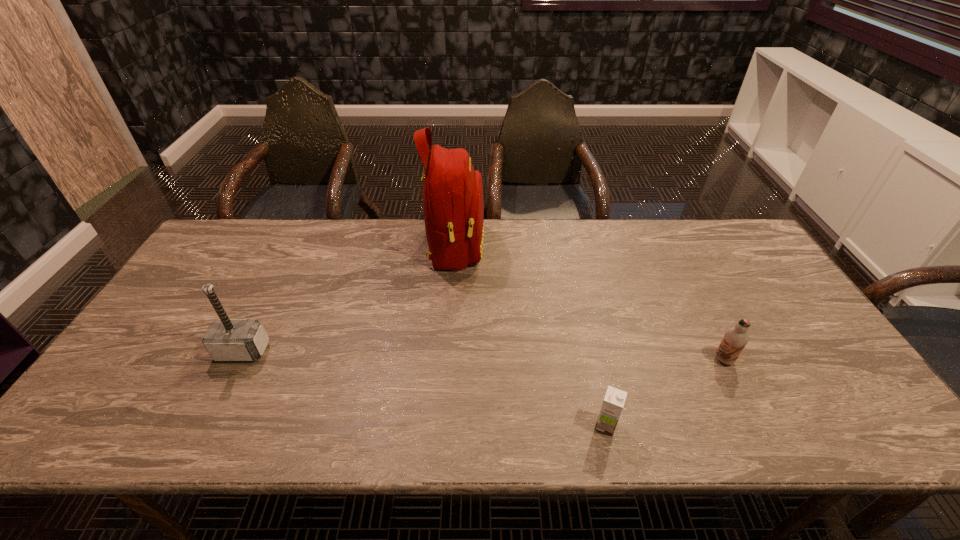
In order to click on free location that satisfies the following two spatial constraints: 1. on the front-facing side of the farthest object; 2. for striking with the head of the leftmost object in this screenshot , I will do `click(447, 351)`.

You are a GUI agent. You are given a task and a screenshot of the screen. Output one action in this format:
    pyautogui.click(x=<x>, y=<y>)
    Task: Click on the vacant point that satisfies the following two spatial constraints: 1. on the front-facing side of the backpack; 2. on the back side of the shortest object
    This screenshot has height=540, width=960.
    Given the screenshot: What is the action you would take?
    pyautogui.click(x=443, y=426)

Where is `blank space that satisfies the following two spatial constraints: 1. on the front-facing side of the farthest object; 2. on the right side of the rightmost object`? The image size is (960, 540). blank space that satisfies the following two spatial constraints: 1. on the front-facing side of the farthest object; 2. on the right side of the rightmost object is located at coordinates (447, 360).